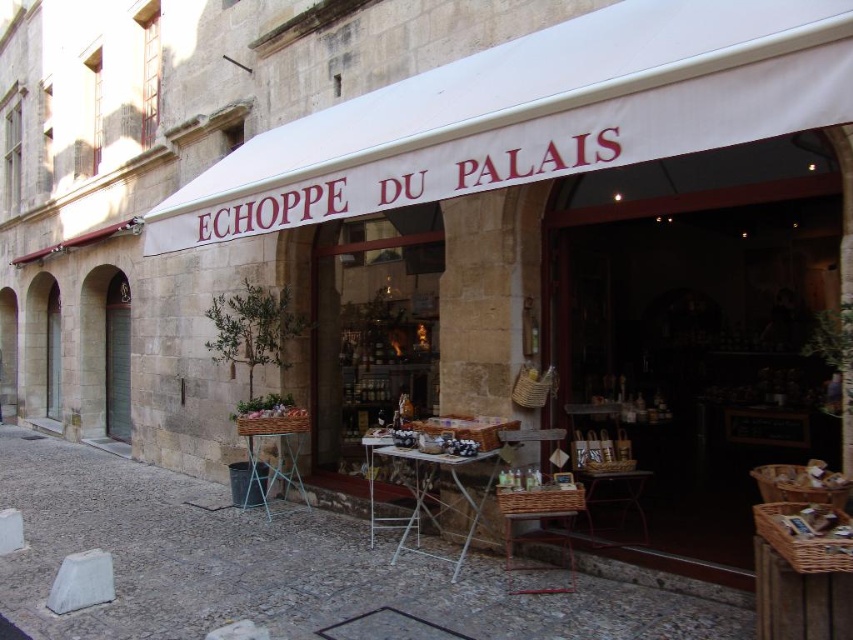
You are standing in front of the storefront and want to locate the white fabric canopy at upper center. According to the coordinates provided, where should you look?

The white fabric canopy at upper center is located at point 0.180 on the x axis and 0.627 on the y axis.

Looking at this image, you are standing in front of the storefront and want to take a photo that includes both the white fabric canopy at upper center and the tables with items for sale. Based on their positions, where should you position yourself to ensure both elements are in the frame?

The white fabric canopy at upper center is located at point (534, 115), so you should position yourself centrally to capture both the canopy above and the tables below in the frame.

You are a customer standing in front of the store and want to see the items on the wooden folding table at center without moving your position. Can you see the top of the white fabric canopy at upper center while looking at the table?

The white fabric canopy at upper center is much taller than the wooden folding table at center, so yes, you can see the top of the white fabric canopy at upper center while looking at the table.